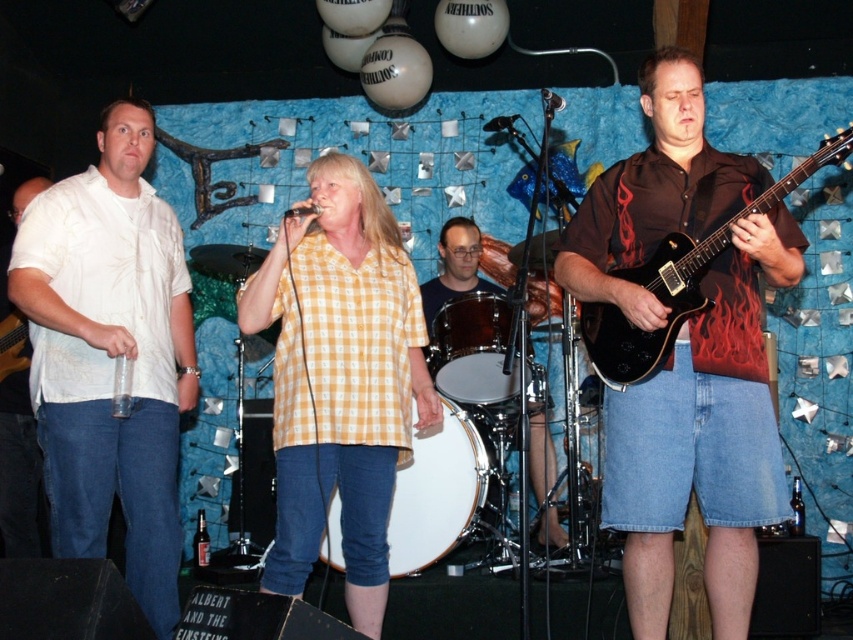
This screenshot has height=640, width=853. What do you see at coordinates (704, 440) in the screenshot?
I see `black glossy guitar at center` at bounding box center [704, 440].

Does black glossy guitar at center have a greater height compared to yellow checkered shirt at center?

Yes.

What are the coordinates of `black glossy guitar at center` in the screenshot? It's located at (704, 440).

Is point (410, 500) behind point (561, 532)?

No, it is in front of (561, 532).

Does white drumhead at center come in front of shiny silver drum at center?

Yes, it is in front of shiny silver drum at center.

You are a GUI agent. You are given a task and a screenshot of the screen. Output one action in this format:
    pyautogui.click(x=<x>, y=<y>)
    Task: Click on the white drumhead at center
    
    Given the screenshot: What is the action you would take?
    pyautogui.click(x=436, y=492)

Is black glossy guitar at center wider than white drumhead at center?

Yes, black glossy guitar at center is wider than white drumhead at center.

Is black glossy guitar at center above white drumhead at center?

Yes.

Is point (618, 486) more distant than point (476, 499)?

That is False.

What are the coordinates of `black glossy guitar at center` in the screenshot? It's located at (704, 440).